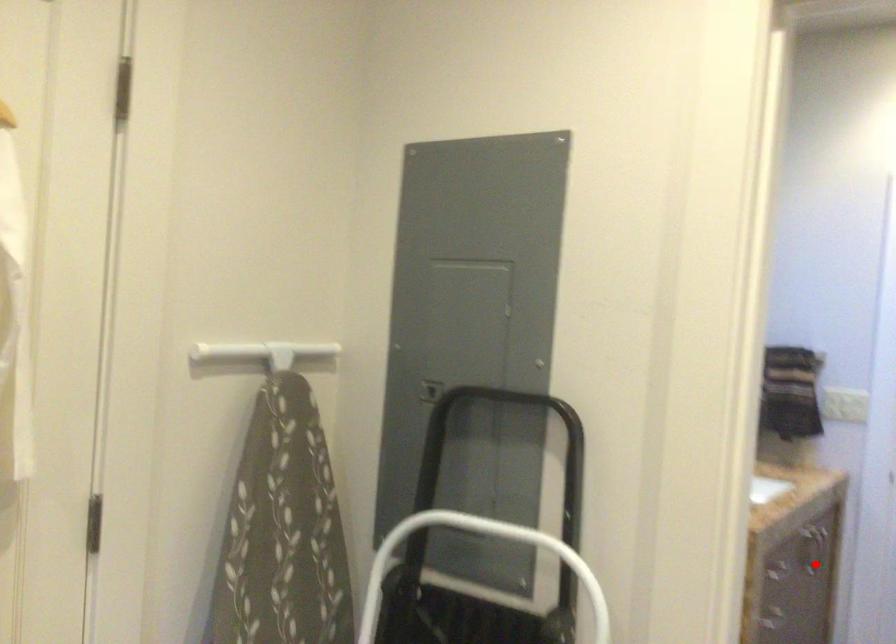
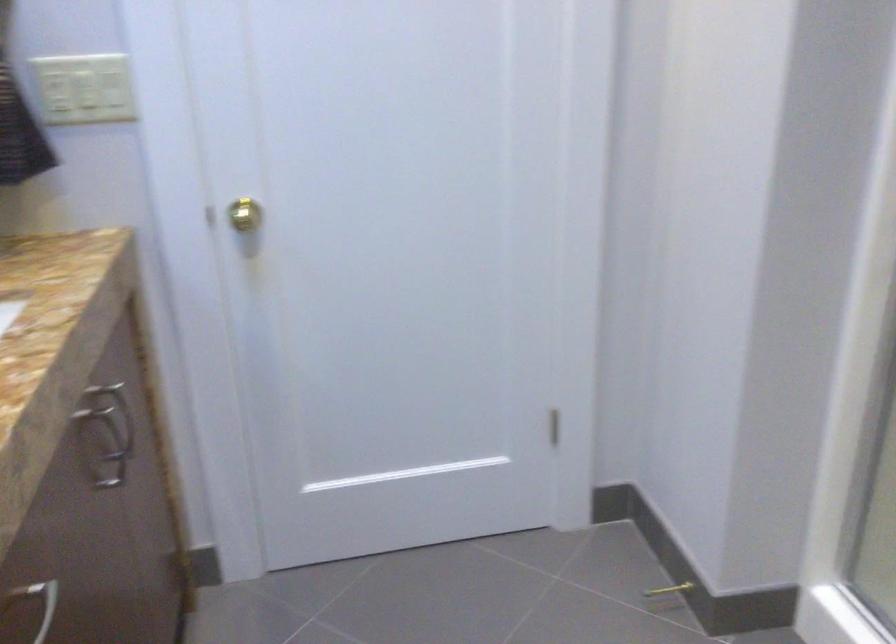
Question: A red point is marked in image1. In image2, is the corresponding 3D point closer to the camera or farther? Reply with the corresponding letter.

Choices:
 (A) The corresponding 3D point is closer.
 (B) The corresponding 3D point is farther.

Answer: (A)